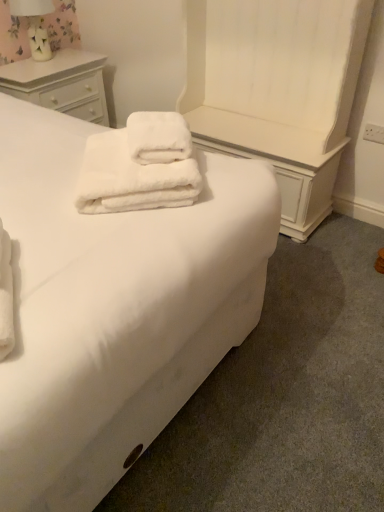
Question: From a real-world perspective, does white fluffy towels at center sit lower than white soft bed at center?

Choices:
 (A) yes
 (B) no

Answer: (B)

Question: Is white fluffy towels at center to the right of white soft bed at center from the viewer's perspective?

Choices:
 (A) no
 (B) yes

Answer: (B)

Question: Is the position of white fluffy towels at center more distant than that of white soft bed at center?

Choices:
 (A) no
 (B) yes

Answer: (B)

Question: Would you say white soft bed at center is part of white fluffy towels at center's contents?

Choices:
 (A) no
 (B) yes

Answer: (A)

Question: From the image's perspective, is white fluffy towels at center located beneath white soft bed at center?

Choices:
 (A) no
 (B) yes

Answer: (A)

Question: Can you confirm if white fluffy towels at center is smaller than white soft bed at center?

Choices:
 (A) yes
 (B) no

Answer: (A)

Question: Is white soft bed at center outside white wood chest of drawers at upper left?

Choices:
 (A) no
 (B) yes

Answer: (B)

Question: Is white soft bed at center oriented away from white wood chest of drawers at upper left?

Choices:
 (A) no
 (B) yes

Answer: (A)

Question: From a real-world perspective, is white soft bed at center located beneath white wood chest of drawers at upper left?

Choices:
 (A) no
 (B) yes

Answer: (A)

Question: Can you confirm if white soft bed at center is thinner than white wood chest of drawers at upper left?

Choices:
 (A) yes
 (B) no

Answer: (B)

Question: Is white soft bed at center wider than white wood chest of drawers at upper left?

Choices:
 (A) yes
 (B) no

Answer: (A)

Question: Is the position of white soft bed at center more distant than that of white wood chest of drawers at upper left?

Choices:
 (A) no
 (B) yes

Answer: (A)

Question: Considering the relative sizes of white soft bed at center and floral fabric lampshade at upper left in the image provided, is white soft bed at center wider than floral fabric lampshade at upper left?

Choices:
 (A) yes
 (B) no

Answer: (A)